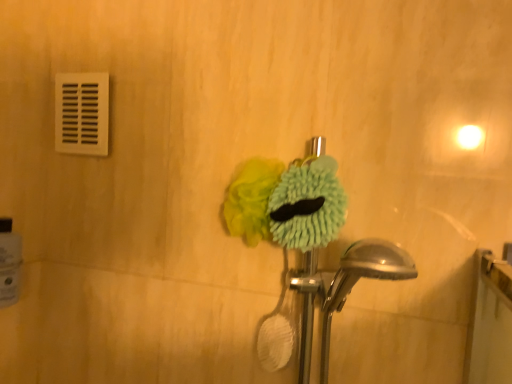
Question: Are green fuzzy brush at center, the 1th flower viewed from the right, and white plastic vent at upper left far apart?

Choices:
 (A) yes
 (B) no

Answer: (B)

Question: From a real-world perspective, is green fuzzy brush at center, the 1th flower viewed from the right, positioned over white plastic vent at upper left based on gravity?

Choices:
 (A) no
 (B) yes

Answer: (A)

Question: Is green fuzzy brush at center, the second flower when ordered from left to right, bigger than white plastic vent at upper left?

Choices:
 (A) yes
 (B) no

Answer: (A)

Question: Is white plastic vent at upper left at the back of green fuzzy brush at center, the second flower when ordered from left to right?

Choices:
 (A) no
 (B) yes

Answer: (A)

Question: Considering the relative sizes of green fuzzy brush at center, the 1th flower viewed from the right, and white plastic vent at upper left in the image provided, is green fuzzy brush at center, the 1th flower viewed from the right, smaller than white plastic vent at upper left?

Choices:
 (A) no
 (B) yes

Answer: (A)

Question: Is green fuzzy brush at center, the 1th flower viewed from the right, taller than white plastic vent at upper left?

Choices:
 (A) no
 (B) yes

Answer: (A)

Question: Is white plastic vent at upper left at the left side of soft yellow sponge at center, the 1th flower positioned from the left?

Choices:
 (A) yes
 (B) no

Answer: (A)

Question: Does white plastic vent at upper left have a greater height compared to soft yellow sponge at center, the 1th flower positioned from the left?

Choices:
 (A) yes
 (B) no

Answer: (A)

Question: Does white plastic vent at upper left have a lesser height compared to soft yellow sponge at center, the 1th flower positioned from the left?

Choices:
 (A) no
 (B) yes

Answer: (A)

Question: Could you tell me if white plastic vent at upper left is turned towards soft yellow sponge at center, the 1th flower positioned from the left?

Choices:
 (A) no
 (B) yes

Answer: (A)

Question: Is white plastic vent at upper left thinner than soft yellow sponge at center, acting as the second flower starting from the right?

Choices:
 (A) yes
 (B) no

Answer: (A)

Question: Is white plastic vent at upper left at the right side of soft yellow sponge at center, acting as the second flower starting from the right?

Choices:
 (A) no
 (B) yes

Answer: (A)

Question: Is the depth of white glossy toilet paper at lower left greater than that of green fuzzy brush at center, the second flower when ordered from left to right?

Choices:
 (A) yes
 (B) no

Answer: (A)